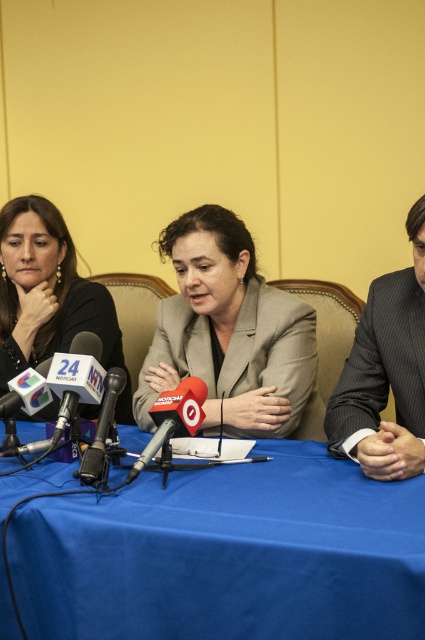
Question: Can you confirm if blue fabric table at center is bigger than matte gray blazer at center?

Choices:
 (A) yes
 (B) no

Answer: (A)

Question: Which point is closer to the camera?

Choices:
 (A) (221, 381)
 (B) (150, 448)
 (C) (170, 460)
 (D) (235, 490)

Answer: (D)

Question: Which object is positioned farthest from the matte black jacket at left?

Choices:
 (A) matte gray blazer at center
 (B) metallic silver microphone at center

Answer: (B)

Question: Observing the image, what is the correct spatial positioning of matte black jacket at left in reference to black matte microphone at center?

Choices:
 (A) left
 (B) right

Answer: (A)

Question: Is blue fabric table at center to the right of gray pinstripe suit at right from the viewer's perspective?

Choices:
 (A) no
 (B) yes

Answer: (A)

Question: Among these objects, which one is farthest from the camera?

Choices:
 (A) metallic silver microphone at center
 (B) red matte microphone at center
 (C) matte black jacket at left
 (D) black matte microphone at center

Answer: (C)